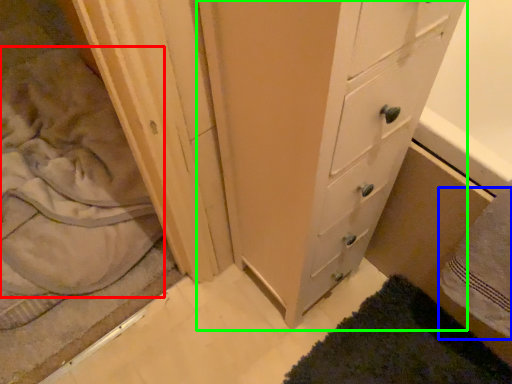
Question: Which object is positioned closest to sheet (highlighted by a red box)? Select from bath towel (highlighted by a blue box) and chest of drawers (highlighted by a green box).

Choices:
 (A) bath towel
 (B) chest of drawers

Answer: (B)